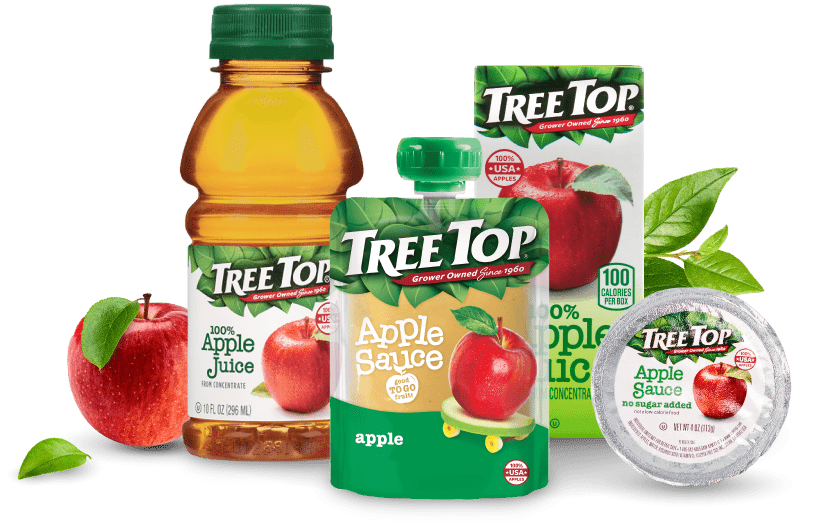
At what (x,y) coordinates should I click in order to perform the action: click on bottle. Please return your answer as a coordinate pair (x, y). The height and width of the screenshot is (527, 835). Looking at the image, I should click on (276, 112).